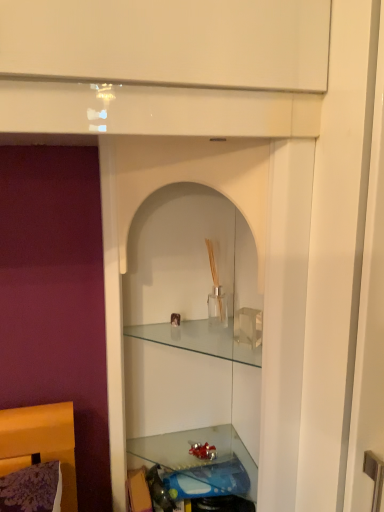
Question: Is clear glass cabinet at center, marked as the second cabinet in a top-to-bottom arrangement, to the left or to the right of clear glass vase at center, which ranks as the second cabinet in bottom-to-top order, in the image?

Choices:
 (A) left
 (B) right

Answer: (A)

Question: Is clear glass cabinet at center, marked as the 1th cabinet in a bottom-to-top arrangement, inside or outside of clear glass vase at center, the first cabinet viewed from the top?

Choices:
 (A) outside
 (B) inside

Answer: (A)

Question: Which is farther from the clear glass cabinet at center, marked as the 1th cabinet in a bottom-to-top arrangement?

Choices:
 (A) clear glass vase at center, which ranks as the second cabinet in bottom-to-top order
 (B) translucent glass shelf at lower center

Answer: (B)

Question: Which object is the closest to the clear glass cabinet at center, marked as the 1th cabinet in a bottom-to-top arrangement?

Choices:
 (A) clear glass vase at center, the first cabinet viewed from the top
 (B) translucent glass shelf at lower center

Answer: (A)